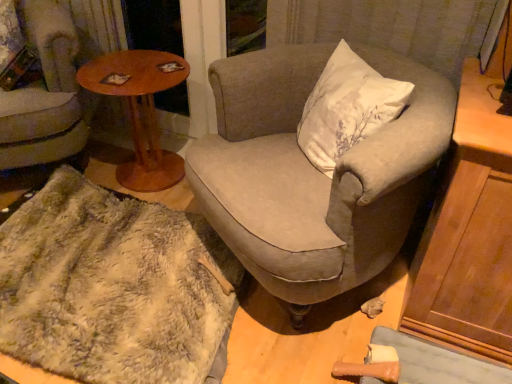
Describe the element at coordinates (112, 286) in the screenshot. I see `fuzzy white blanket at lower left` at that location.

What do you see at coordinates (153, 25) in the screenshot? This screenshot has height=384, width=512. I see `wooden round table at left` at bounding box center [153, 25].

What are the coordinates of `wooden round table at left` in the screenshot? It's located at (140, 110).

This screenshot has height=384, width=512. What are the coordinates of `fuzzy white blanket at lower left` in the screenshot? It's located at (112, 286).

Is wooden round table at left to the left or to the right of wooden round table at left in the image?

Clearly, wooden round table at left is on the right of wooden round table at left in the image.

Does wooden round table at left touch wooden round table at left?

There is a gap between wooden round table at left and wooden round table at left.

How different are the orientations of wooden round table at left and wooden round table at left in degrees?

wooden round table at left and wooden round table at left are facing 4.44 degrees away from each other.

Is wooden round table at left positioned with its back to wooden round table at left?

wooden round table at left does not have its back to wooden round table at left.

Does wooden round table at left have a larger size compared to textured gray armchair at center, the first chair positioned from the right?

No, wooden round table at left is not bigger than textured gray armchair at center, the first chair positioned from the right.

From the image's perspective, would you say wooden round table at left is shown under textured gray armchair at center, marked as the second chair in a left-to-right arrangement?

No, from the image's perspective, wooden round table at left is not below textured gray armchair at center, marked as the second chair in a left-to-right arrangement.

Based on the photo, from a real-world perspective, does wooden round table at left sit lower than textured gray armchair at center, the first chair positioned from the right?

No, from a real-world perspective, wooden round table at left is not beneath textured gray armchair at center, the first chair positioned from the right.

Is wooden round table at left oriented towards fuzzy fabric chair at lower left, arranged as the 2th chair when viewed from the right?

No, wooden round table at left is not aimed at fuzzy fabric chair at lower left, arranged as the 2th chair when viewed from the right.

Can we say wooden round table at left lies outside fuzzy fabric chair at lower left, arranged as the 2th chair when viewed from the right?

Indeed, wooden round table at left is completely outside fuzzy fabric chair at lower left, arranged as the 2th chair when viewed from the right.

From the image's perspective, is wooden round table at left on fuzzy fabric chair at lower left, arranged as the 2th chair when viewed from the right?

No, from the image's perspective, wooden round table at left is not above fuzzy fabric chair at lower left, arranged as the 2th chair when viewed from the right.

Considering the relative positions of wooden round table at left and fuzzy fabric chair at lower left, positioned as the first chair in left-to-right order, in the image provided, is wooden round table at left to the left of fuzzy fabric chair at lower left, positioned as the first chair in left-to-right order, from the viewer's perspective?

Incorrect, wooden round table at left is not on the left side of fuzzy fabric chair at lower left, positioned as the first chair in left-to-right order.

Would you consider wooden round table at left to be distant from fuzzy white blanket at lower left?

No.

Looking at their sizes, would you say wooden round table at left is wider or thinner than fuzzy white blanket at lower left?

In the image, wooden round table at left appears to be more narrow than fuzzy white blanket at lower left.

How distant is textured gray armchair at center, marked as the second chair in a left-to-right arrangement, from fuzzy white blanket at lower left?

The distance of textured gray armchair at center, marked as the second chair in a left-to-right arrangement, from fuzzy white blanket at lower left is 19.47 inches.

I want to click on blanket lying below the textured gray armchair at center, the first chair positioned from the right (from the image's perspective), so click(x=112, y=286).

Is textured gray armchair at center, marked as the second chair in a left-to-right arrangement, not inside fuzzy white blanket at lower left?

textured gray armchair at center, marked as the second chair in a left-to-right arrangement, is positioned outside fuzzy white blanket at lower left.

How many degrees apart are the facing directions of textured gray armchair at center, marked as the second chair in a left-to-right arrangement, and wooden round table at left?

39.5 degrees.

Is textured gray armchair at center, the first chair positioned from the right, facing towards wooden round table at left?

No, textured gray armchair at center, the first chair positioned from the right, is not facing towards wooden round table at left.

Looking at the image, does textured gray armchair at center, the first chair positioned from the right, seem bigger or smaller compared to wooden round table at left?

In the image, textured gray armchair at center, the first chair positioned from the right, appears to be larger than wooden round table at left.

From the image's perspective, is textured gray armchair at center, the first chair positioned from the right, below wooden round table at left?

Correct, textured gray armchair at center, the first chair positioned from the right, appears lower than wooden round table at left in the image.

Considering the relative sizes of wooden round table at left and textured gray armchair at center, marked as the second chair in a left-to-right arrangement, in the image provided, is wooden round table at left wider than textured gray armchair at center, marked as the second chair in a left-to-right arrangement,?

No.

From a real-world perspective, is wooden round table at left under textured gray armchair at center, the first chair positioned from the right?

Yes.

Between wooden round table at left and textured gray armchair at center, marked as the second chair in a left-to-right arrangement, which one has smaller size?

Smaller between the two is wooden round table at left.

You are a GUI agent. You are given a task and a screenshot of the screen. Output one action in this format:
    pyautogui.click(x=<x>, y=<y>)
    Task: Click on the screen door to the right of wooden round table at left
    The width and height of the screenshot is (512, 384).
    Given the screenshot: What is the action you would take?
    pyautogui.click(x=153, y=25)

Locate an element on the screen. This screenshot has width=512, height=384. chair below the wooden round table at left (from a real-world perspective) is located at coordinates (313, 173).

Based on their spatial positions, is wooden round table at left or fuzzy fabric chair at lower left, arranged as the 2th chair when viewed from the right, further from fuzzy white blanket at lower left?

wooden round table at left.

Based on their spatial positions, is textured gray armchair at center, marked as the second chair in a left-to-right arrangement, or fuzzy white blanket at lower left closer to fuzzy fabric chair at lower left, arranged as the 2th chair when viewed from the right?

fuzzy white blanket at lower left is closer to fuzzy fabric chair at lower left, arranged as the 2th chair when viewed from the right.

From the image, which object appears to be nearer to fuzzy fabric chair at lower left, arranged as the 2th chair when viewed from the right, wooden round table at left or fuzzy white blanket at lower left?

Based on the image, wooden round table at left appears to be nearer to fuzzy fabric chair at lower left, arranged as the 2th chair when viewed from the right.

Based on their spatial positions, is fuzzy fabric chair at lower left, arranged as the 2th chair when viewed from the right, or wooden round table at left further from wooden round table at left?

Based on the image, fuzzy fabric chair at lower left, arranged as the 2th chair when viewed from the right, appears to be further to wooden round table at left.

Estimate the real-world distances between objects in this image. Which object is further from wooden round table at left, textured gray armchair at center, the first chair positioned from the right, or wooden round table at left?

textured gray armchair at center, the first chair positioned from the right, is positioned further to the anchor wooden round table at left.

Estimate the real-world distances between objects in this image. Which object is further from textured gray armchair at center, the first chair positioned from the right, wooden round table at left or wooden round table at left?

wooden round table at left is positioned further to the anchor textured gray armchair at center, the first chair positioned from the right.

Estimate the real-world distances between objects in this image. Which object is closer to fuzzy white blanket at lower left, wooden round table at left or textured gray armchair at center, marked as the second chair in a left-to-right arrangement?

textured gray armchair at center, marked as the second chair in a left-to-right arrangement.

Looking at the image, which one is located closer to wooden round table at left, fuzzy fabric chair at lower left, positioned as the first chair in left-to-right order, or textured gray armchair at center, marked as the second chair in a left-to-right arrangement?

The object closer to wooden round table at left is fuzzy fabric chair at lower left, positioned as the first chair in left-to-right order.

Find the location of `table between fuzzy fabric chair at lower left, arranged as the 2th chair when viewed from the right, and wooden round table at left from left to right`. table between fuzzy fabric chair at lower left, arranged as the 2th chair when viewed from the right, and wooden round table at left from left to right is located at coordinates (x=140, y=110).

Identify the location of table between wooden round table at left and fuzzy white blanket at lower left from top to bottom. (140, 110).

Locate an element on the screen. The image size is (512, 384). blanket located between textured gray armchair at center, the first chair positioned from the right, and wooden round table at left in the depth direction is located at coordinates coord(112,286).

Image resolution: width=512 pixels, height=384 pixels. What are the coordinates of `table between fuzzy fabric chair at lower left, positioned as the first chair in left-to-right order, and fuzzy white blanket at lower left in the up-down direction` in the screenshot? It's located at (140, 110).